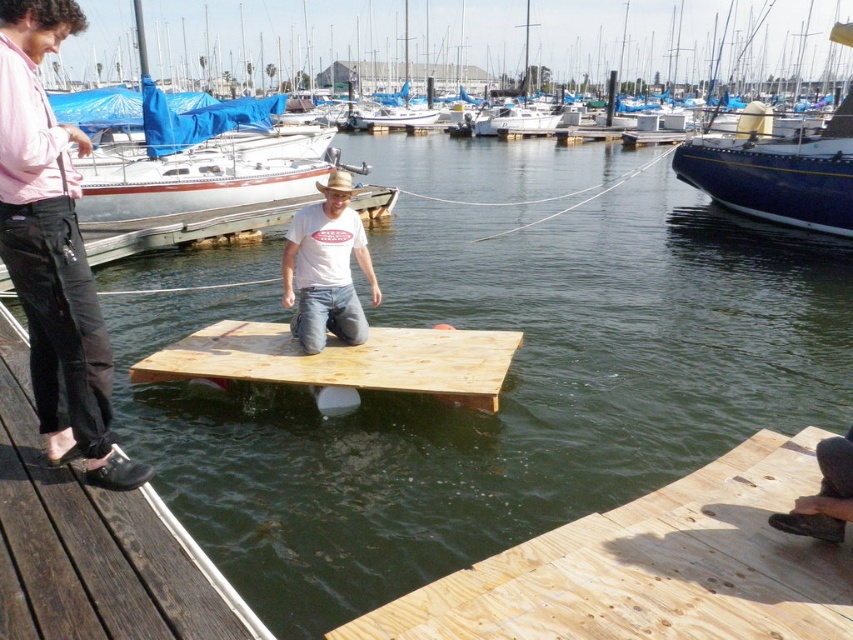
Question: Which of the following is the closest to the observer?

Choices:
 (A) light brown wood at center
 (B) blue glossy sailboat at right

Answer: (A)

Question: Which object is closer to the camera taking this photo?

Choices:
 (A) light brown wood at lower right
 (B) brown wooden dock at lower left
 (C) matte black pants at left

Answer: (B)

Question: Can you confirm if brown wooden dock at lower left is positioned below blue glossy sailboat at right?

Choices:
 (A) yes
 (B) no

Answer: (A)

Question: Does blue glossy sailboat at right have a lesser width compared to white cotton t-shirt at center?

Choices:
 (A) yes
 (B) no

Answer: (B)

Question: Which point is farther to the camera?

Choices:
 (A) (782, 184)
 (B) (332, 252)

Answer: (A)

Question: Observing the image, what is the correct spatial positioning of matte black pants at left in reference to light brown wood at center?

Choices:
 (A) right
 (B) left

Answer: (B)